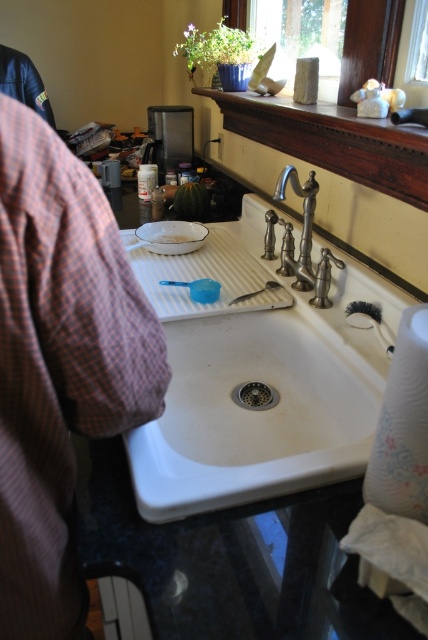
The height and width of the screenshot is (640, 428). What do you see at coordinates (403, 426) in the screenshot?
I see `white paper at right` at bounding box center [403, 426].

Based on the photo, does white paper at right have a larger size compared to metallic silver drain at center?

Correct, white paper at right is larger in size than metallic silver drain at center.

Does point (406, 358) lie behind point (270, 397)?

No, (406, 358) is in front of (270, 397).

Locate an element on the screen. This screenshot has height=640, width=428. white paper at right is located at coordinates (403, 426).

Between brown checkered shirt at left and white matte plate at center, which one is positioned lower?

brown checkered shirt at left

Is point (149, 321) less distant than point (186, 221)?

Yes, it is in front of point (186, 221).

Find the location of a particular element. brown checkered shirt at left is located at coordinates (59, 364).

Is point (275, 198) positioned in front of point (259, 387)?

Yes, point (275, 198) is closer to viewer.

Is polished chrome faucet at center thinner than metallic silver drain at center?

In fact, polished chrome faucet at center might be wider than metallic silver drain at center.

Find the location of `polished chrome faucet at center`. polished chrome faucet at center is located at coordinates (303, 225).

This screenshot has height=640, width=428. Identify the location of polished chrome faucet at center. (303, 225).